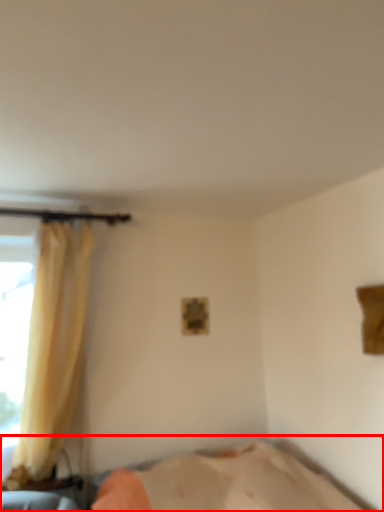
Question: From the image's perspective, what is the correct spatial positioning of bed (annotated by the red box) in reference to curtain?

Choices:
 (A) below
 (B) above

Answer: (A)